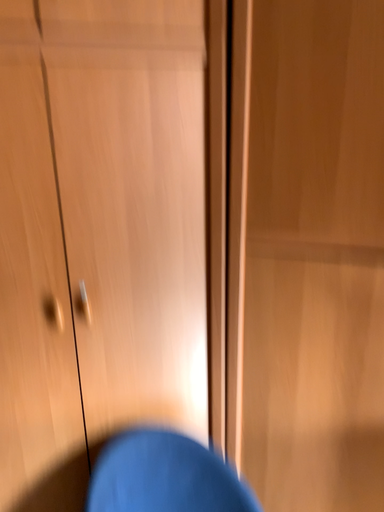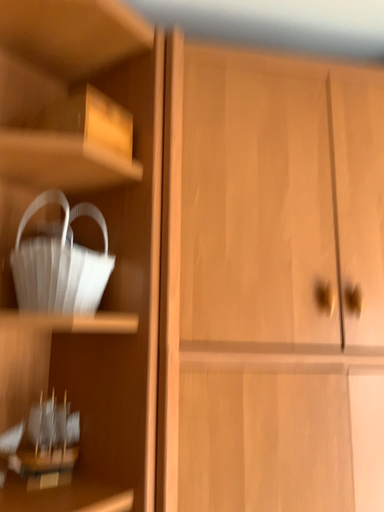
Question: How did the camera likely rotate when shooting the video?

Choices:
 (A) rotated left
 (B) rotated right

Answer: (A)